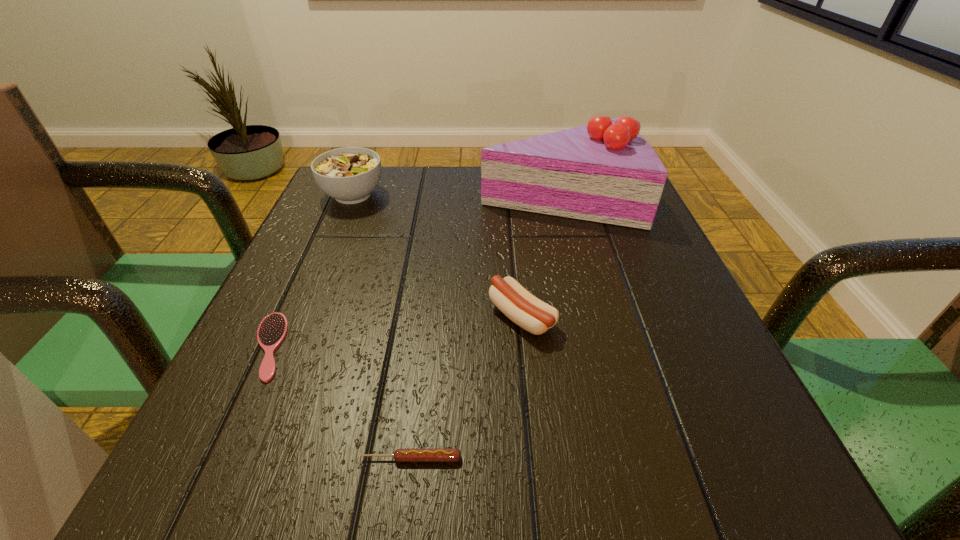
Where is `free space located 0.400m on the right of the hairbrush`? free space located 0.400m on the right of the hairbrush is located at coordinates (546, 346).

Where is `free space located on the back of the nearest object`? free space located on the back of the nearest object is located at coordinates (429, 310).

The height and width of the screenshot is (540, 960). In order to click on cake that is at the far edge in this screenshot , I will do `click(606, 172)`.

Locate an element on the screen. The image size is (960, 540). soup bowl that is at the far edge is located at coordinates (349, 175).

Find the location of `object located at the near edge`. object located at the near edge is located at coordinates (402, 454).

Identify the location of soup bowl present at the left edge. Image resolution: width=960 pixels, height=540 pixels. (349, 175).

The width and height of the screenshot is (960, 540). I want to click on hairbrush at the left edge, so click(273, 329).

Where is `object positioned at the right edge`? The image size is (960, 540). object positioned at the right edge is located at coordinates (606, 172).

Where is `object that is at the far left corner`? Image resolution: width=960 pixels, height=540 pixels. object that is at the far left corner is located at coordinates (349, 175).

I want to click on object that is at the far right corner, so click(606, 172).